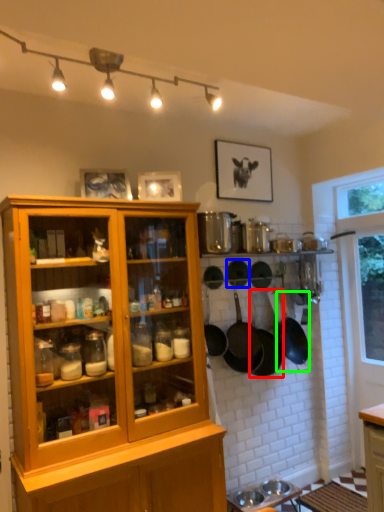
Question: Which object is positioned closest to frying pan (highlighted by a red box)? Select from frying pan (highlighted by a blue box) and frying pan (highlighted by a green box).

Choices:
 (A) frying pan
 (B) frying pan

Answer: (B)